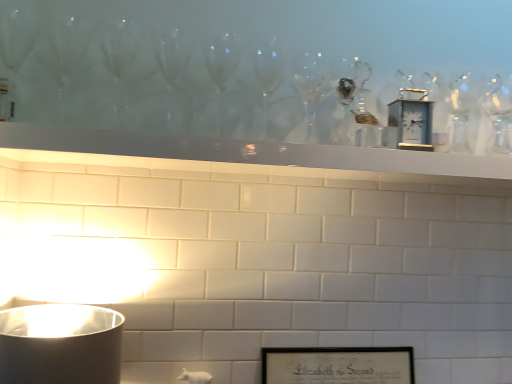
Question: Is point (184, 155) positioned closer to the camera than point (305, 379)?

Choices:
 (A) closer
 (B) farther

Answer: (A)

Question: In terms of width, does white glossy mantle at upper center look wider or thinner when compared to black matte picture frame at lower center?

Choices:
 (A) thin
 (B) wide

Answer: (B)

Question: Which of these objects is positioned closest to the black matte picture frame at lower center?

Choices:
 (A) metallic silver clock at upper center
 (B) white glossy mantle at upper center

Answer: (B)

Question: Which is farther from the metallic silver clock at upper center?

Choices:
 (A) white glossy mantle at upper center
 (B) black matte picture frame at lower center

Answer: (B)